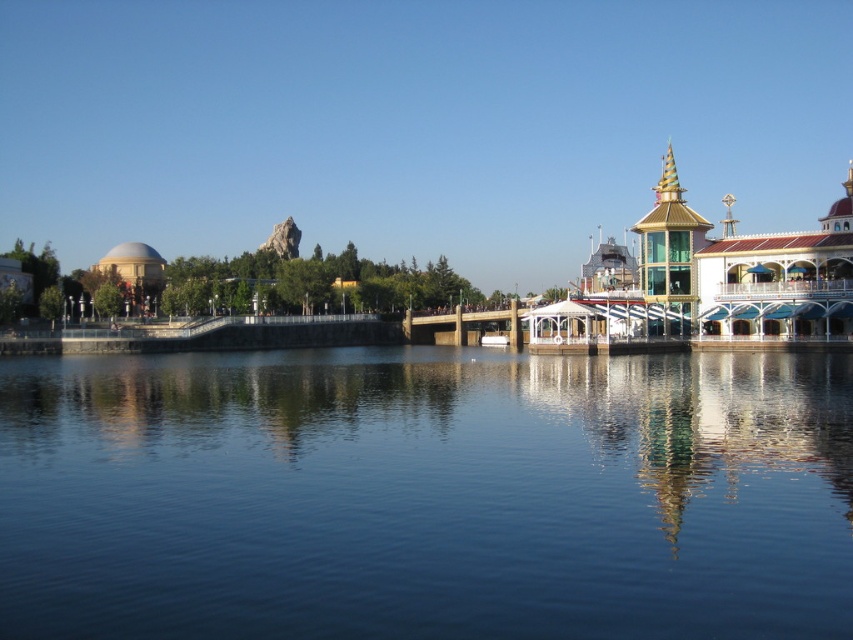
Question: Does white glossy building at center have a smaller size compared to white glossy building at right?

Choices:
 (A) yes
 (B) no

Answer: (B)

Question: Which point is farther from the camera taking this photo?

Choices:
 (A) (323, 266)
 (B) (498, 330)

Answer: (A)

Question: Does transparent water at center have a lesser width compared to white glossy building at center?

Choices:
 (A) no
 (B) yes

Answer: (B)

Question: Which object is farther from the camera taking this photo?

Choices:
 (A) white glossy building at right
 (B) transparent water at center

Answer: (A)

Question: Can you confirm if white glossy building at right is thinner than brown wooden dock at center?

Choices:
 (A) no
 (B) yes

Answer: (A)

Question: Based on their relative distances, which object is nearer to the white glossy building at center?

Choices:
 (A) matte white building at left
 (B) transparent water at center
 (C) white plastic boat at center
 (D) white glossy building at right

Answer: (A)